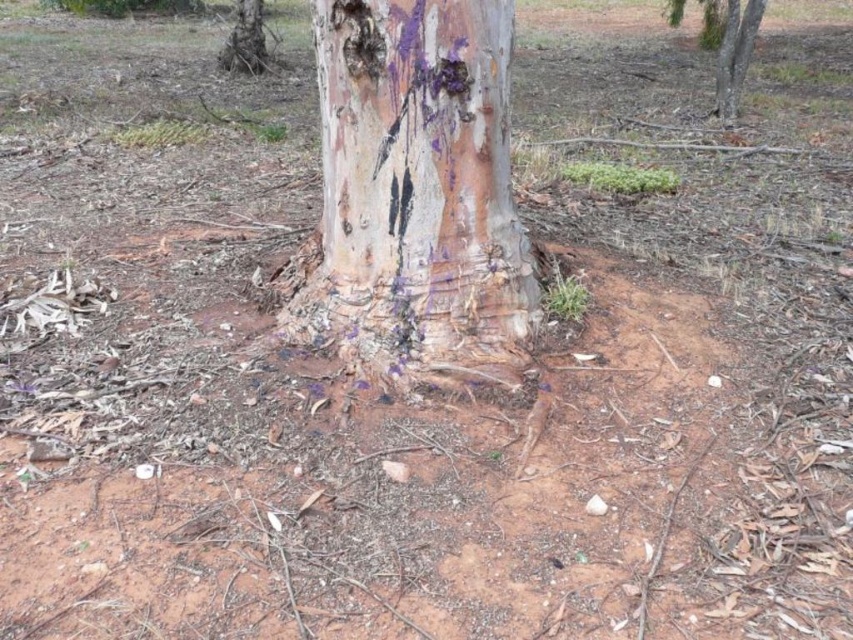
Can you confirm if purple rough bark at upper right is taller than purple rough bark at upper left?

Yes, purple rough bark at upper right is taller than purple rough bark at upper left.

Who is more forward, (730,12) or (230,52)?

Point (730,12) is in front.

Find the location of a particular element. purple rough bark at upper right is located at coordinates (729, 45).

Is smooth bark tree trunk at center above purple rough bark at upper left?

No.

Describe the element at coordinates (415, 196) in the screenshot. I see `smooth bark tree trunk at center` at that location.

Who is more distant from viewer, [412,148] or [245,20]?

Positioned behind is point [245,20].

I want to click on smooth bark tree trunk at center, so click(415, 196).

Between point (393, 308) and point (728, 26), which one is positioned in front?

Point (393, 308)

Which is below, smooth bark tree trunk at center or purple rough bark at upper right?

smooth bark tree trunk at center is lower down.

Image resolution: width=853 pixels, height=640 pixels. What do you see at coordinates (415, 196) in the screenshot?
I see `smooth bark tree trunk at center` at bounding box center [415, 196].

Where is `smooth bark tree trunk at center`? smooth bark tree trunk at center is located at coordinates (415, 196).